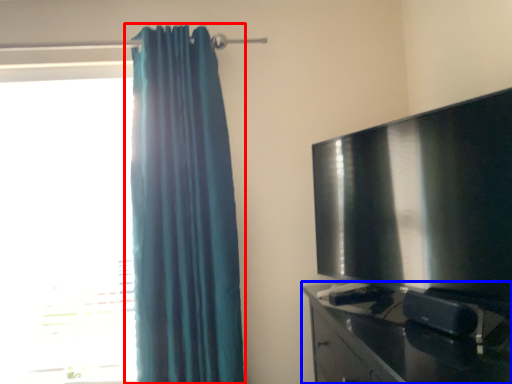
Question: Which point is further to the camera, curtain (highlighted by a red box) or furniture (highlighted by a blue box)?

Choices:
 (A) curtain
 (B) furniture

Answer: (A)